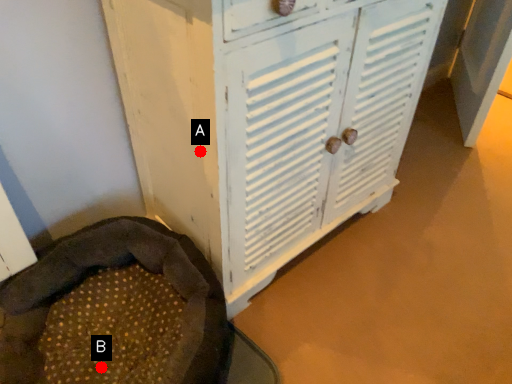
Question: Two points are circled on the image, labeled by A and B beside each circle. Which point is closer to the camera?

Choices:
 (A) A is closer
 (B) B is closer

Answer: (A)